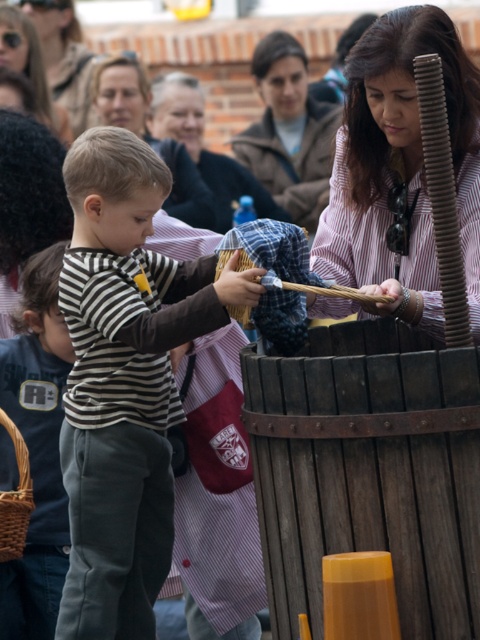
Question: Which point is closer to the camera?

Choices:
 (A) striped fabric shirt at center
 (B) striped cotton shirt at center
 (C) matte brown shirt at center
 (D) matte pink shirt at upper center

Answer: (B)

Question: Can you confirm if striped fabric shirt at center is positioned to the right of brown woven basket at lower left?

Choices:
 (A) no
 (B) yes

Answer: (B)

Question: Can you confirm if matte pink shirt at upper center is positioned to the left of striped shirt at upper center?

Choices:
 (A) no
 (B) yes

Answer: (B)

Question: Which of the following is the farthest from the observer?

Choices:
 (A) (155, 458)
 (B) (244, 317)
 (C) (122, 116)
 (D) (273, 202)

Answer: (C)

Question: Can you confirm if brown woven basket at lower left is positioned below wooden stick at center?

Choices:
 (A) yes
 (B) no

Answer: (A)

Question: Which point appears farthest from the camera in this image?

Choices:
 (A) (192, 80)
 (B) (98, 76)
 (C) (35, 90)

Answer: (A)